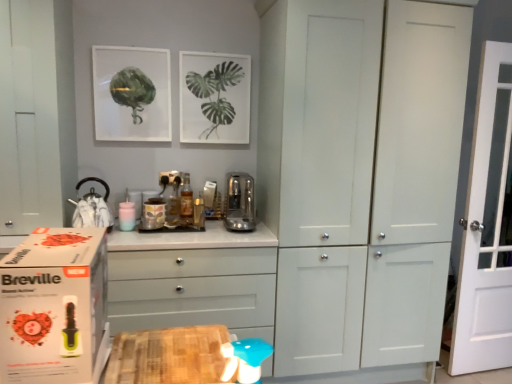
Question: Is white glossy chest of drawers at center positioned beyond the bounds of shiny silver kettle at left, arranged as the third appliance when viewed from the right?

Choices:
 (A) no
 (B) yes

Answer: (B)

Question: Is white glossy chest of drawers at center further to the viewer compared to shiny silver kettle at left, arranged as the third appliance when viewed from the right?

Choices:
 (A) yes
 (B) no

Answer: (B)

Question: From a real-world perspective, is white glossy chest of drawers at center located beneath shiny silver kettle at left, arranged as the third appliance when viewed from the right?

Choices:
 (A) no
 (B) yes

Answer: (B)

Question: Does white glossy chest of drawers at center have a lesser width compared to shiny silver kettle at left, arranged as the third appliance when viewed from the right?

Choices:
 (A) no
 (B) yes

Answer: (A)

Question: Is white glossy chest of drawers at center in front of shiny silver kettle at left, which appears as the 1th appliance when viewed from the left?

Choices:
 (A) no
 (B) yes

Answer: (B)

Question: Is white glossy chest of drawers at center at the left side of shiny silver kettle at left, arranged as the third appliance when viewed from the right?

Choices:
 (A) yes
 (B) no

Answer: (B)

Question: Is matte glass picture frame at upper left, the second picture frame when ordered from right to left, wider than white wooden door at right?

Choices:
 (A) no
 (B) yes

Answer: (A)

Question: From a real-world perspective, is matte glass picture frame at upper left, the 1th picture frame positioned from the left, on white wooden door at right?

Choices:
 (A) yes
 (B) no

Answer: (A)

Question: Is white wooden door at right at the back of matte glass picture frame at upper left, the second picture frame when ordered from right to left?

Choices:
 (A) no
 (B) yes

Answer: (A)

Question: Is matte glass picture frame at upper left, the 1th picture frame positioned from the left, surrounding white wooden door at right?

Choices:
 (A) yes
 (B) no

Answer: (B)

Question: Is matte glass picture frame at upper left, the 1th picture frame positioned from the left, shorter than white wooden door at right?

Choices:
 (A) yes
 (B) no

Answer: (A)

Question: Does matte glass picture frame at upper left, the 1th picture frame positioned from the left, appear on the right side of white wooden door at right?

Choices:
 (A) yes
 (B) no

Answer: (B)

Question: Does white matte cupboard at center have a greater height compared to white glossy chest of drawers at center?

Choices:
 (A) no
 (B) yes

Answer: (B)